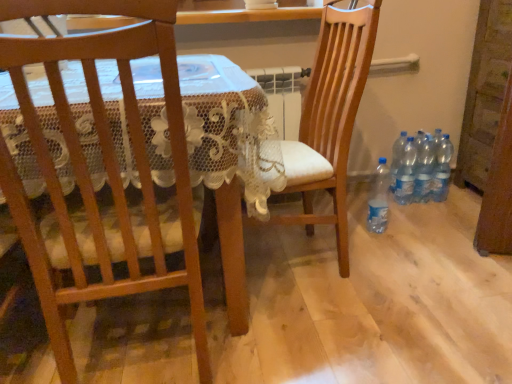
Locate an element on the screen. The image size is (512, 384). free space that is in between clear plastic bottle at lower right, which appears as the 1th bottle when viewed from the left, and clear plastic bottles at lower right, which is the 1th bottle from right to left is located at coordinates (407, 214).